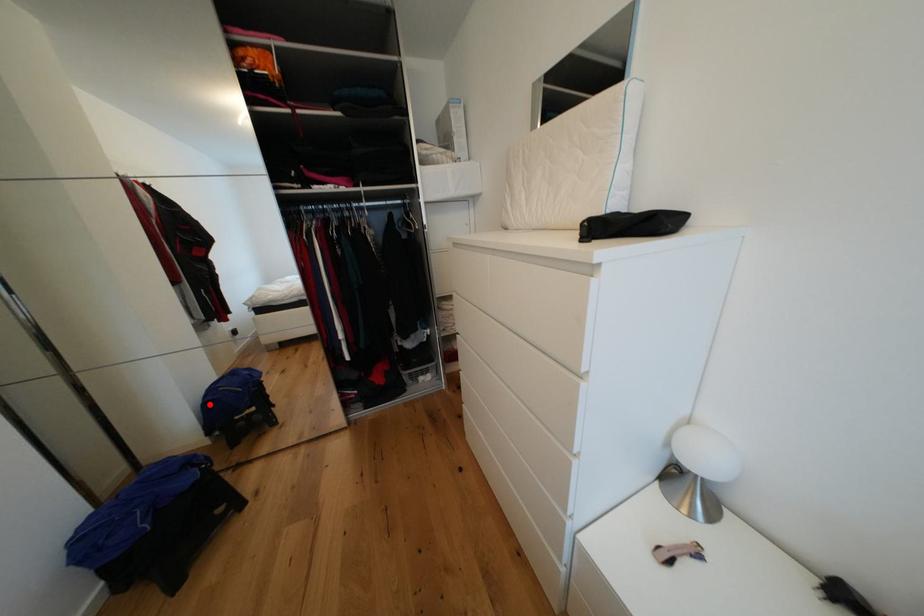
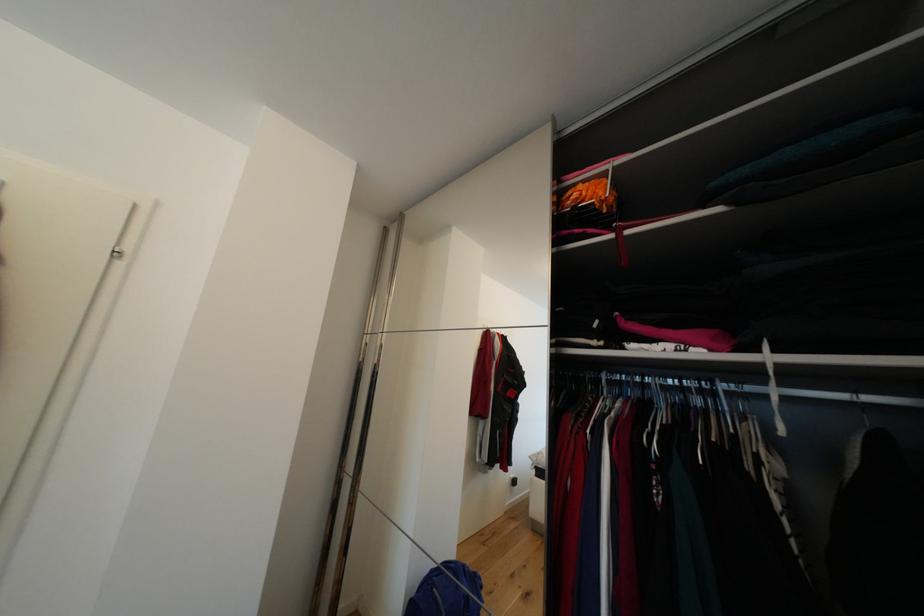
Question: I am providing you with two images of the same scene from different viewpoints. A red point is shown in image1. For the corresponding object point in image2, is it positioned nearer or farther from the camera?

Choices:
 (A) Nearer
 (B) Farther

Answer: (A)